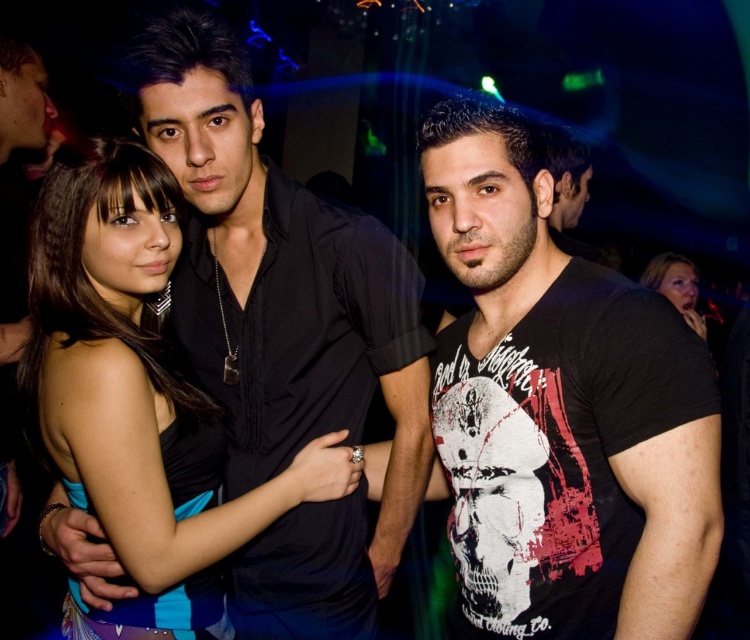
Question: Which is farther from the smooth skin face at upper right?

Choices:
 (A) matte black dress at center
 (B) black printed t-shirt at center

Answer: (A)

Question: Is black printed t-shirt at center closer to camera compared to smooth skin face at upper right?

Choices:
 (A) yes
 (B) no

Answer: (A)

Question: Which object is the closest to the matte black dress at center?

Choices:
 (A) black printed t-shirt at center
 (B) smooth skin face at upper right

Answer: (A)

Question: Is black printed t-shirt at center thinner than matte black dress at center?

Choices:
 (A) no
 (B) yes

Answer: (B)

Question: Which point is closer to the camera?

Choices:
 (A) (622, 481)
 (B) (654, 262)

Answer: (A)

Question: Is matte black dress at center bigger than smooth skin face at upper right?

Choices:
 (A) yes
 (B) no

Answer: (A)